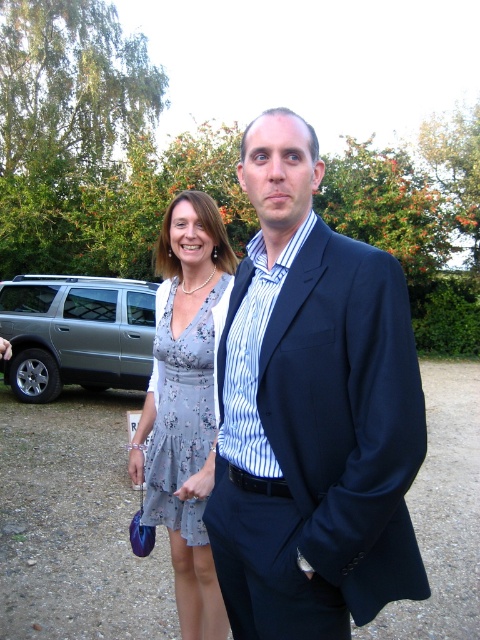
Can you confirm if satin silver suv at lower left is thinner than floral-patterned fabric dress at center?

No, satin silver suv at lower left is not thinner than floral-patterned fabric dress at center.

Is satin silver suv at lower left below floral-patterned fabric dress at center?

Incorrect, satin silver suv at lower left is not positioned below floral-patterned fabric dress at center.

Measure the distance between satin silver suv at lower left and camera.

They are 28.28 feet apart.

Image resolution: width=480 pixels, height=640 pixels. Find the location of `satin silver suv at lower left`. satin silver suv at lower left is located at coordinates tap(75, 333).

Is point (183, 426) farther from viewer compared to point (197, 353)?

Yes, it is.

Which is in front, point (205, 637) or point (187, 326)?

Positioned in front is point (205, 637).

In order to click on floral dress at center in this screenshot , I will do [186, 403].

Which is below, dark blue suit at center or floral dress at center?

floral dress at center

In the scene shown: Can you confirm if dark blue suit at center is positioned above floral dress at center?

Yes, dark blue suit at center is above floral dress at center.

Find the location of a particular element. Image resolution: width=480 pixels, height=640 pixels. dark blue suit at center is located at coordinates (312, 412).

At what (x,y) coordinates should I click in order to perform the action: click on dark blue suit at center. Please return your answer as a coordinate pair (x, y). The width and height of the screenshot is (480, 640). Looking at the image, I should click on (312, 412).